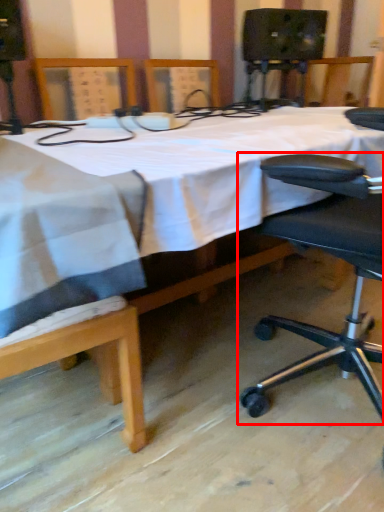
Question: In this image, where is chair (annotated by the red box) located relative to table?

Choices:
 (A) left
 (B) right

Answer: (B)